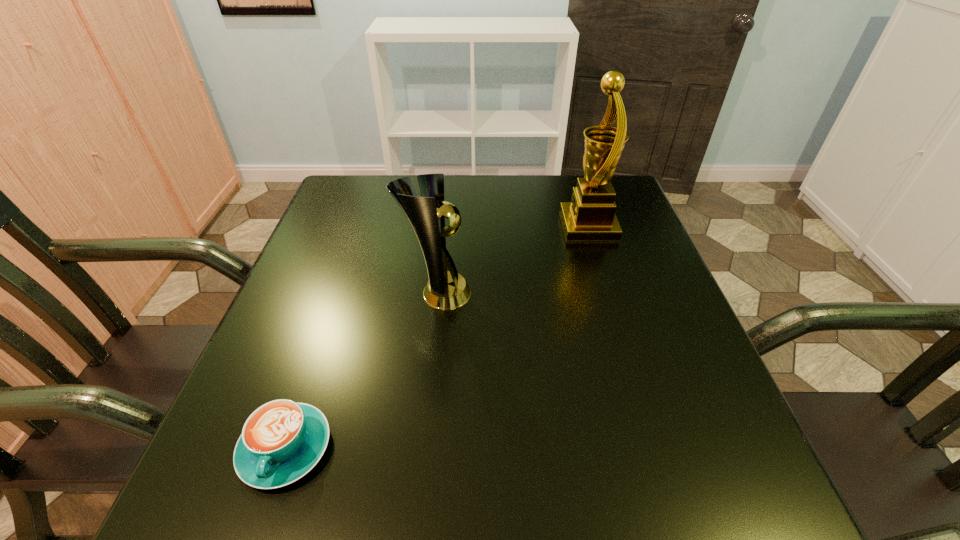
Locate an element on the screen. object at the far edge is located at coordinates (590, 216).

This screenshot has height=540, width=960. In order to click on object positioned at the near edge in this screenshot , I will do `click(281, 441)`.

Find the location of a particular element. The width and height of the screenshot is (960, 540). object that is positioned at the left edge is located at coordinates (281, 441).

At what (x,y) coordinates should I click in order to perform the action: click on object that is at the right edge. Please return your answer as a coordinate pair (x, y). This screenshot has height=540, width=960. Looking at the image, I should click on (590, 216).

Locate an element on the screen. This screenshot has width=960, height=540. object at the near left corner is located at coordinates (281, 441).

The image size is (960, 540). Find the location of `object situated at the far right corner`. object situated at the far right corner is located at coordinates (590, 216).

Where is `free space at the far edge of the desktop`? Image resolution: width=960 pixels, height=540 pixels. free space at the far edge of the desktop is located at coordinates (537, 205).

This screenshot has width=960, height=540. Find the location of `free spot at the left edge of the desktop`. free spot at the left edge of the desktop is located at coordinates (368, 257).

This screenshot has height=540, width=960. What are the coordinates of `vacant point at the right edge` in the screenshot? It's located at (625, 276).

Where is `vacant space at the far left corner`? vacant space at the far left corner is located at coordinates (390, 200).